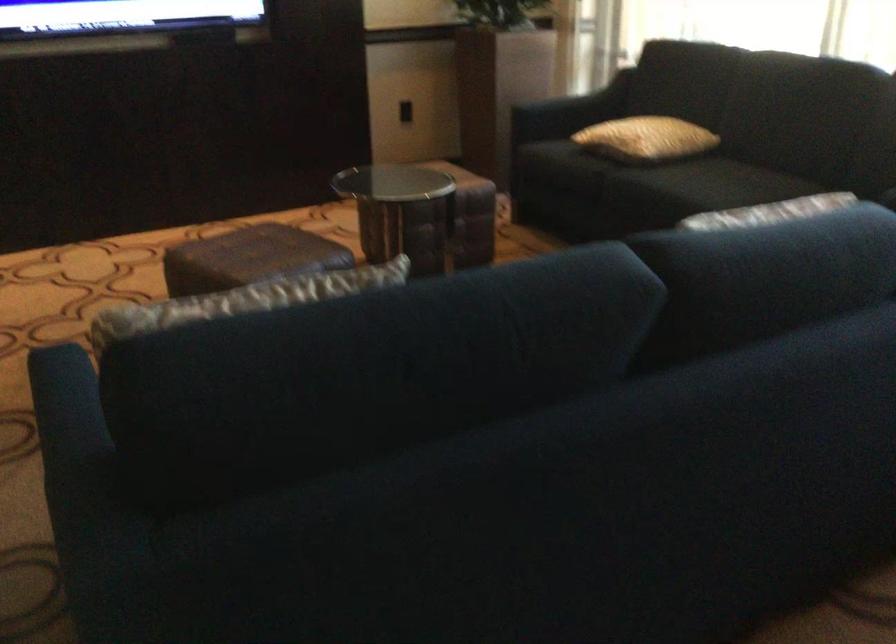
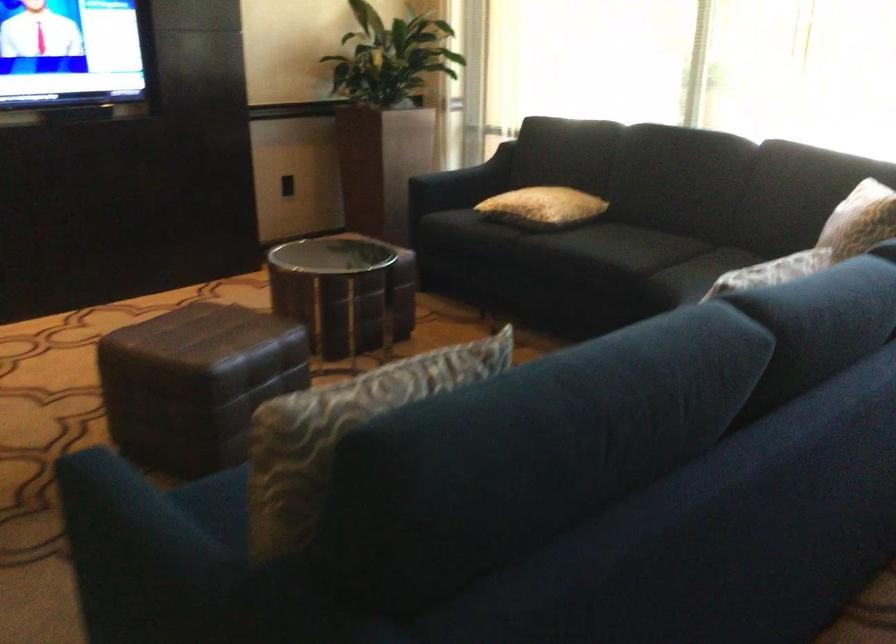
Locate, in the second image, the point that corresponds to (713,194) in the first image.

(626, 254)